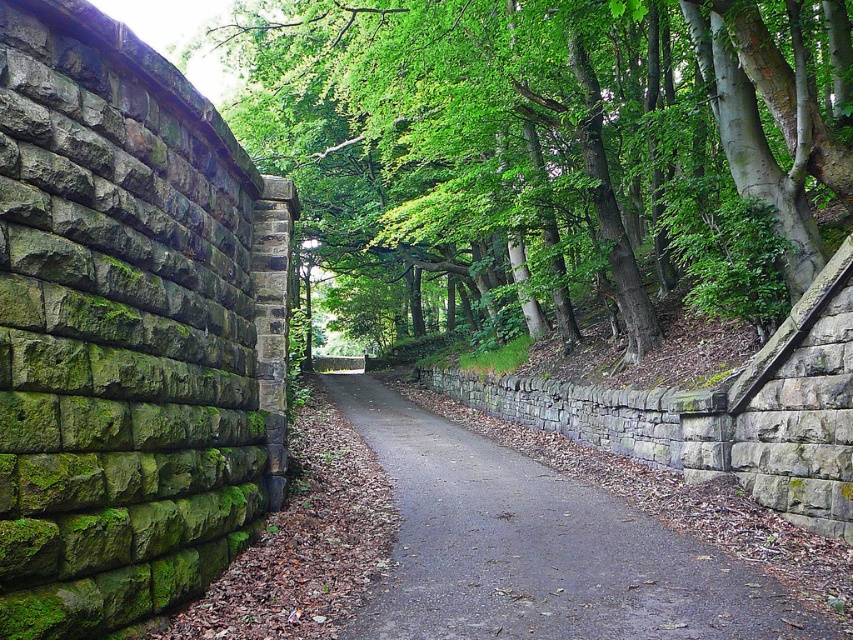
Can you confirm if green leafy tree at center is wider than gray stone wall at center?

Yes.

Is green leafy tree at center taller than gray stone wall at center?

Yes.

Describe the element at coordinates (561, 138) in the screenshot. I see `green leafy tree at center` at that location.

The image size is (853, 640). I want to click on green leafy tree at center, so click(x=561, y=138).